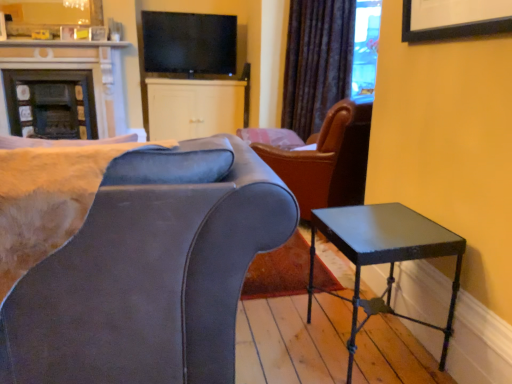
Question: In the image, is matte black tv at upper center positioned in front of or behind velvet dark brown curtain at upper center?

Choices:
 (A) front
 (B) behind

Answer: (B)

Question: Is point (219, 61) positioned closer to the camera than point (324, 64)?

Choices:
 (A) closer
 (B) farther

Answer: (B)

Question: Estimate the real-world distances between objects in this image. Which object is closer to the velvet dark brown curtain at upper center?

Choices:
 (A) suede-like gray chair at left
 (B) matte black tv at upper center
 (C) white matte cabinet at center
 (D) metallic black side table at lower right
 (E) matte black fireplace at upper left

Answer: (C)

Question: Based on their relative distances, which object is farther from the suede-like gray chair at left?

Choices:
 (A) metallic black side table at lower right
 (B) matte black tv at upper center
 (C) velvet dark brown curtain at upper center
 (D) matte black fireplace at upper left
 (E) white matte cabinet at center

Answer: (D)